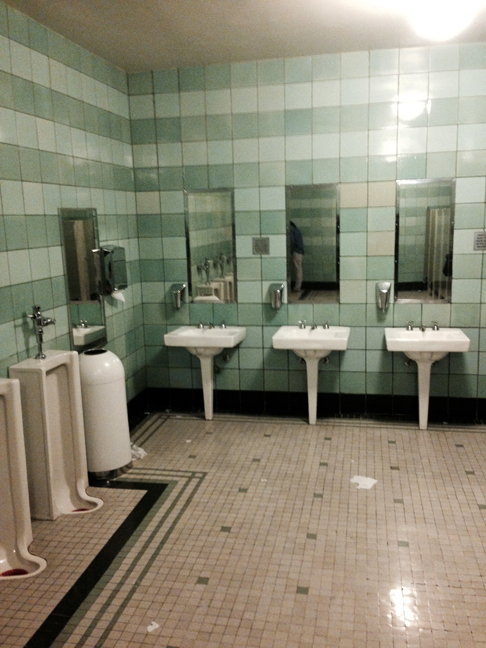
The height and width of the screenshot is (648, 486). What are the coordinates of `wall` in the screenshot? It's located at (272, 100), (58, 98).